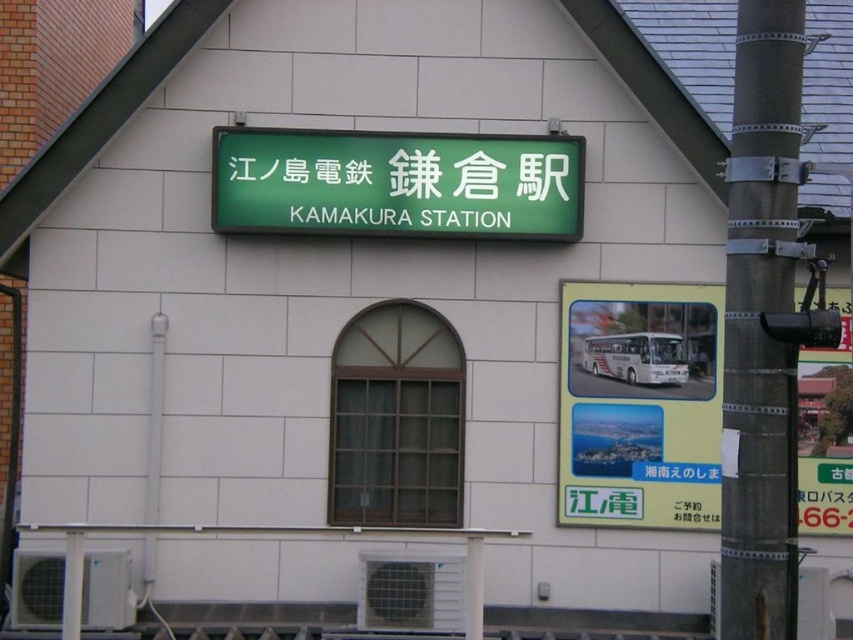
Does green plastic signboard at center have a smaller size compared to metallic gray pole at right?

Indeed, green plastic signboard at center has a smaller size compared to metallic gray pole at right.

This screenshot has height=640, width=853. What do you see at coordinates (640, 404) in the screenshot?
I see `green plastic signboard at center` at bounding box center [640, 404].

The width and height of the screenshot is (853, 640). In order to click on green plastic signboard at center in this screenshot , I will do coord(640,404).

I want to click on green plastic signboard at center, so click(x=640, y=404).

Does green plastic signboard at center appear on the left side of green matte signboard at center?

No, green plastic signboard at center is not to the left of green matte signboard at center.

Does green plastic signboard at center appear under green matte signboard at center?

Yes, green plastic signboard at center is below green matte signboard at center.

Is point (718, 333) positioned behind point (312, 196)?

Yes, it is behind point (312, 196).

Find the location of a particular element. The height and width of the screenshot is (640, 853). green plastic signboard at center is located at coordinates (640, 404).

Is metallic gray pole at right closer to the viewer compared to green matte signboard at center?

Yes, metallic gray pole at right is closer to the viewer.

This screenshot has width=853, height=640. Describe the element at coordinates (761, 324) in the screenshot. I see `metallic gray pole at right` at that location.

Between point (743, 17) and point (352, 205), which one is positioned in front?

Point (743, 17) is more forward.

Where is `metallic gray pole at right`? metallic gray pole at right is located at coordinates click(761, 324).